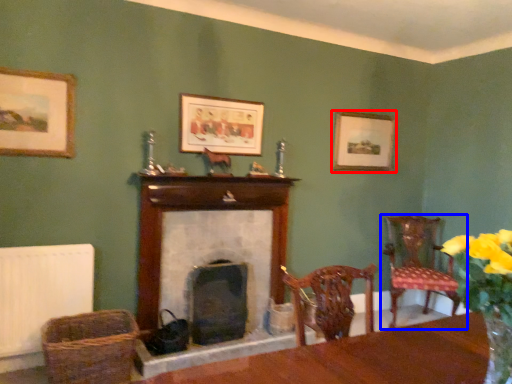
Question: Among these objects, which one is farthest to the camera, picture frame (highlighted by a red box) or chair (highlighted by a blue box)?

Choices:
 (A) picture frame
 (B) chair

Answer: (A)